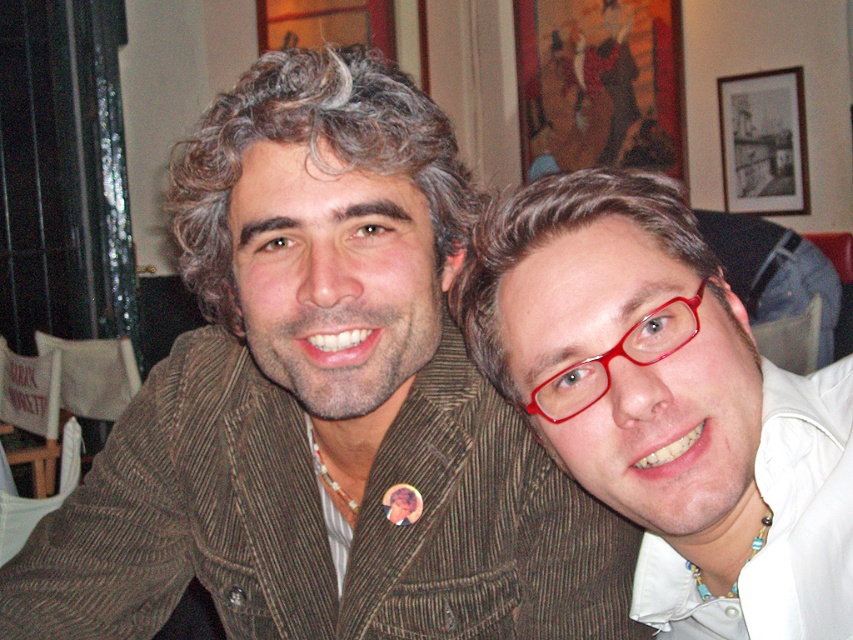
Can you confirm if matte red glasses at center is positioned to the right of black matte picture frame at upper right?

In fact, matte red glasses at center is to the left of black matte picture frame at upper right.

Can you confirm if matte red glasses at center is positioned above black matte picture frame at upper right?

Incorrect, matte red glasses at center is not positioned above black matte picture frame at upper right.

Where is `matte red glasses at center`? matte red glasses at center is located at coordinates (666, 403).

At what (x,y) coordinates should I click in order to perform the action: click on matte red glasses at center. Please return your answer as a coordinate pair (x, y). Looking at the image, I should click on (666, 403).

The width and height of the screenshot is (853, 640). What do you see at coordinates (323, 403) in the screenshot? I see `brown corduroy jacket at center` at bounding box center [323, 403].

Between brown corduroy jacket at center and black matte picture frame at upper right, which one appears on the right side from the viewer's perspective?

black matte picture frame at upper right is more to the right.

Which is in front, point (225, 621) or point (734, 161)?

Point (225, 621) is more forward.

Locate an element on the screen. This screenshot has height=640, width=853. brown corduroy jacket at center is located at coordinates (323, 403).

Where is `brown corduroy jacket at center`? The height and width of the screenshot is (640, 853). brown corduroy jacket at center is located at coordinates (323, 403).

In the scene shown: Can you confirm if brown corduroy jacket at center is positioned above matte red glasses at center?

No.

Is point (341, 131) more distant than point (811, 621)?

Yes, point (341, 131) is farther from viewer.

You are a GUI agent. You are given a task and a screenshot of the screen. Output one action in this format:
    pyautogui.click(x=<x>, y=<y>)
    Task: Click on the brown corduroy jacket at center
    Image resolution: width=853 pixels, height=640 pixels.
    Given the screenshot: What is the action you would take?
    pyautogui.click(x=323, y=403)